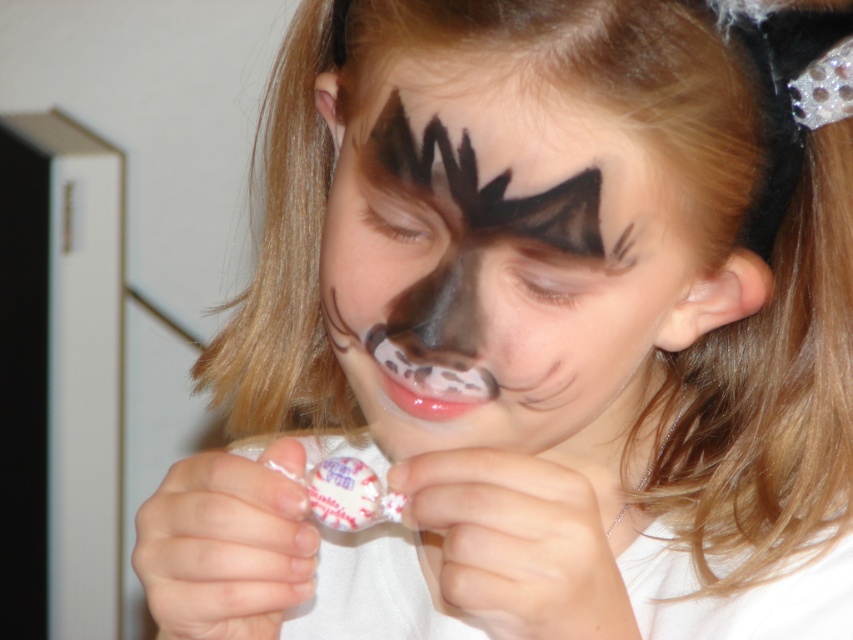
What is located at the coordinate point (486,177) in the image?

The point (486,177) indicates a black matte or soft eyebrow at upper center.

The girl is focusing on unwrapping a candy. She has two black items on her face. Which one is taller, the matte black face paint at center or the black matte eyebrow at upper center?

The matte black face paint at center is taller than the black matte eyebrow at upper center.